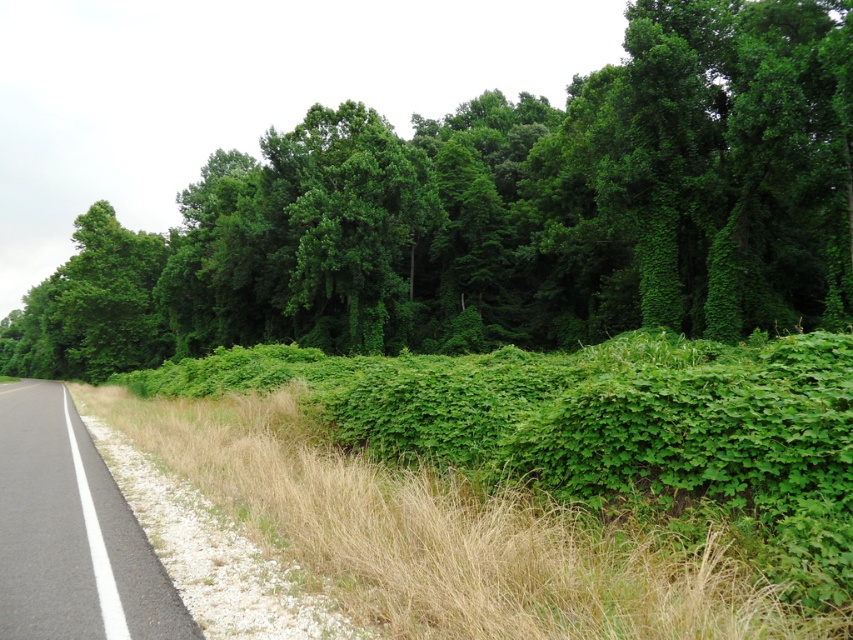
Question: Is the position of green leafy bush at center more distant than that of black asphalt road at left?

Choices:
 (A) yes
 (B) no

Answer: (A)

Question: Which of these objects is positioned closest to the green leafy bush at center?

Choices:
 (A) black asphalt road at left
 (B) green leafy grass at center

Answer: (A)

Question: Considering the relative positions of green leafy bush at center and green leafy grass at center in the image provided, where is green leafy bush at center located with respect to green leafy grass at center?

Choices:
 (A) left
 (B) right

Answer: (A)

Question: Based on their relative distances, which object is farther from the green leafy bush at center?

Choices:
 (A) green leafy grass at center
 (B) black asphalt road at left

Answer: (A)

Question: Observing the image, what is the correct spatial positioning of green leafy grass at center in reference to black asphalt road at left?

Choices:
 (A) below
 (B) above

Answer: (B)

Question: Which of the following is the farthest from the observer?

Choices:
 (A) black asphalt road at left
 (B) green leafy bush at center
 (C) green leafy grass at center

Answer: (B)